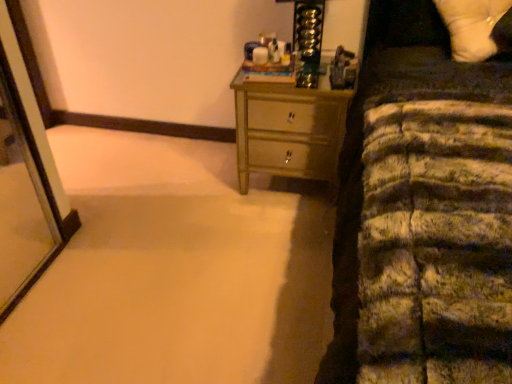
Question: From a real-world perspective, is metallic gold chest of drawers at center physically above white soft pillow at upper right?

Choices:
 (A) no
 (B) yes

Answer: (A)

Question: Is metallic gold chest of drawers at center not inside white soft pillow at upper right?

Choices:
 (A) yes
 (B) no

Answer: (A)

Question: Is white soft pillow at upper right completely or partially inside metallic gold chest of drawers at center?

Choices:
 (A) no
 (B) yes

Answer: (A)

Question: Is the depth of metallic gold chest of drawers at center greater than that of white soft pillow at upper right?

Choices:
 (A) no
 (B) yes

Answer: (B)

Question: Is metallic gold chest of drawers at center beside white soft pillow at upper right?

Choices:
 (A) yes
 (B) no

Answer: (B)

Question: From the image's perspective, is metallic gold chest of drawers at center above white soft pillow at upper right?

Choices:
 (A) yes
 (B) no

Answer: (B)

Question: Is the position of white soft pillow at upper right more distant than that of metallic gold chest of drawers at center?

Choices:
 (A) no
 (B) yes

Answer: (A)

Question: Is white soft pillow at upper right directly adjacent to metallic gold chest of drawers at center?

Choices:
 (A) yes
 (B) no

Answer: (B)

Question: Is white soft pillow at upper right oriented away from metallic gold chest of drawers at center?

Choices:
 (A) no
 (B) yes

Answer: (A)

Question: Does white soft pillow at upper right have a greater width compared to metallic gold chest of drawers at center?

Choices:
 (A) no
 (B) yes

Answer: (A)

Question: From the image's perspective, is white soft pillow at upper right below metallic gold chest of drawers at center?

Choices:
 (A) no
 (B) yes

Answer: (A)

Question: Would you say white soft pillow at upper right is a long distance from metallic gold chest of drawers at center?

Choices:
 (A) yes
 (B) no

Answer: (B)

Question: In the image, is white soft pillow at upper right on the left side or the right side of metallic gold chest of drawers at center?

Choices:
 (A) right
 (B) left

Answer: (A)